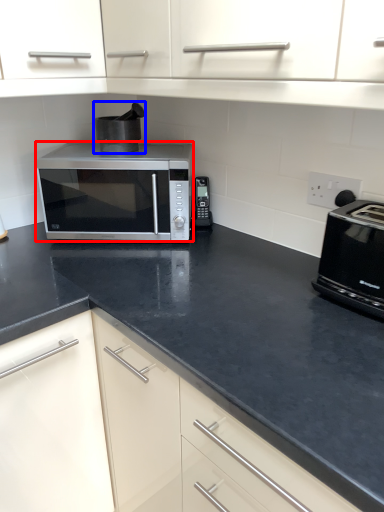
Question: Which of the following is the closest to the observer, microwave oven (highlighted by a red box) or appliance (highlighted by a blue box)?

Choices:
 (A) microwave oven
 (B) appliance

Answer: (A)